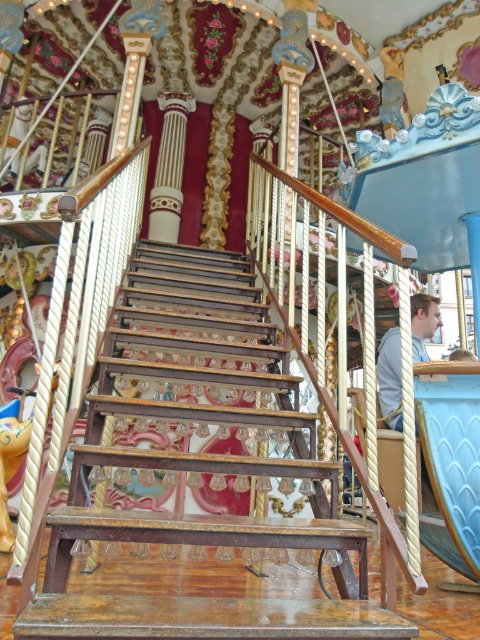
Is point (215, 486) positioned after point (429, 307)?

No, (215, 486) is in front of (429, 307).

Who is positioned more to the left, wooden stairs at center or light blue shirt at center?

From the viewer's perspective, wooden stairs at center appears more on the left side.

Where is `wooden stairs at center`? This screenshot has width=480, height=640. wooden stairs at center is located at coordinates (199, 426).